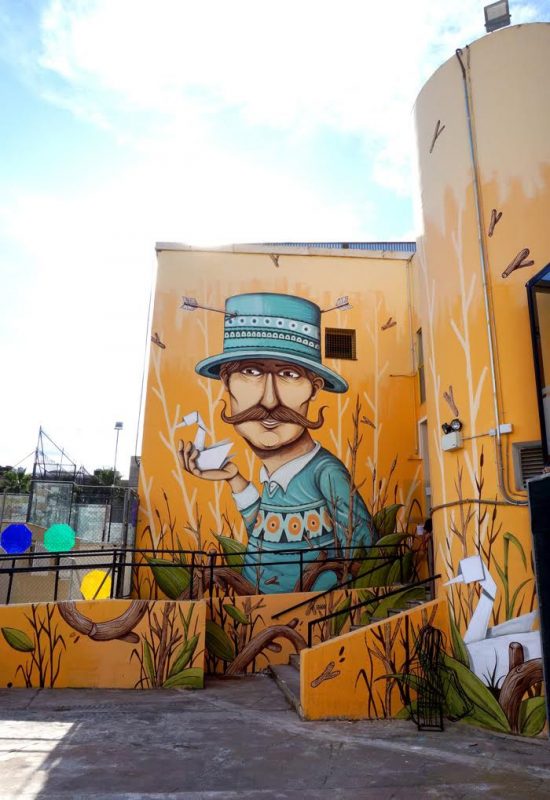
Identify the location of yellow wall. (359, 676).